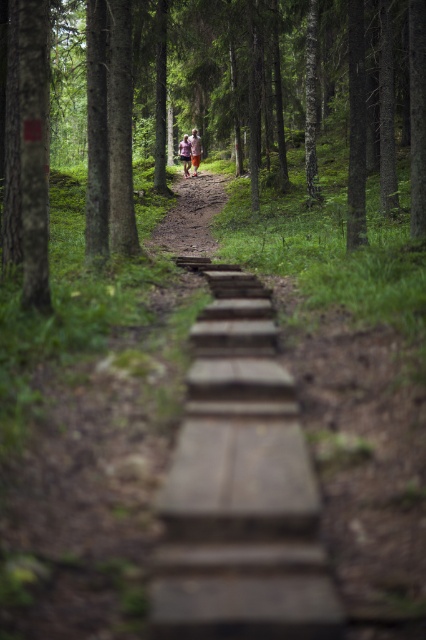
Is point (409, 102) farther from viewer compared to point (331, 612)?

Yes.

Between point (134, 16) and point (210, 412), which one is positioned behind?

The point (134, 16) is behind.

Find the location of a particular element. The image size is (426, 640). green matte tree at center is located at coordinates (278, 92).

Between point (360, 122) and point (180, 204), which one is positioned behind?

The point (180, 204) is more distant.

Who is taller, green matte tree at center or brown wooden trail at center?

Standing taller between the two is green matte tree at center.

Find the location of a particular element. The height and width of the screenshot is (640, 426). green matte tree at center is located at coordinates (278, 92).

Identify the location of green matte tree at center. This screenshot has width=426, height=640. (278, 92).

Can you confirm if green matte tree at center is bigger than pink fabric person at center?

Yes, green matte tree at center is bigger than pink fabric person at center.

Is green matte tree at center taller than pink fabric person at center?

Yes.

Which is behind, point (380, 138) or point (198, 138)?

Point (198, 138)

Find the location of a particular element. This screenshot has height=640, width=426. green matte tree at center is located at coordinates (278, 92).